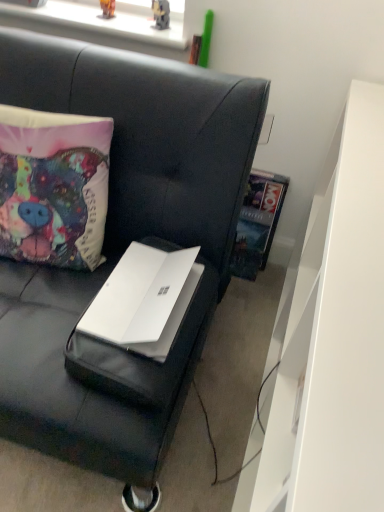
Question: Relative to white matte dresser at right, is white matte laptop at center in front or behind?

Choices:
 (A) behind
 (B) front

Answer: (A)

Question: Is white matte laptop at center inside the boundaries of white matte dresser at right, or outside?

Choices:
 (A) inside
 (B) outside

Answer: (B)

Question: Which is nearer to the white matte laptop at center?

Choices:
 (A) metallic plastic toy at upper center, the second toy in the left-to-right sequence
 (B) matte plastic toy at upper center, which is the 1th toy in left-to-right order
 (C) white matte dresser at right
 (D) hardcover book at upper right
 (E) white matte laptop at center

Answer: (E)

Question: Which object is positioned farthest from the white matte laptop at center?

Choices:
 (A) white matte laptop at center
 (B) hardcover book at upper right
 (C) matte plastic toy at upper center, which is the 1th toy in left-to-right order
 (D) white matte dresser at right
 (E) metallic plastic toy at upper center, the 1th toy positioned from the right

Answer: (C)